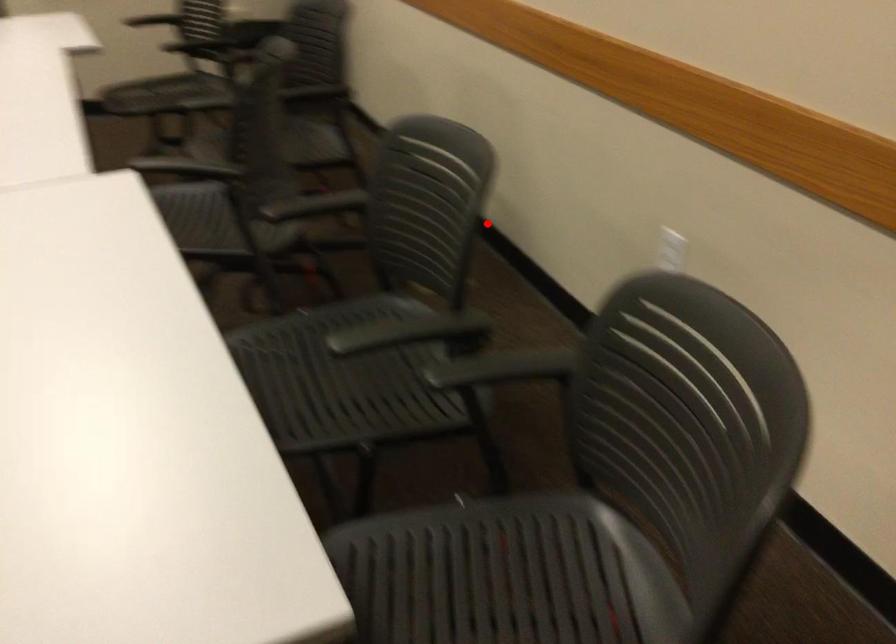
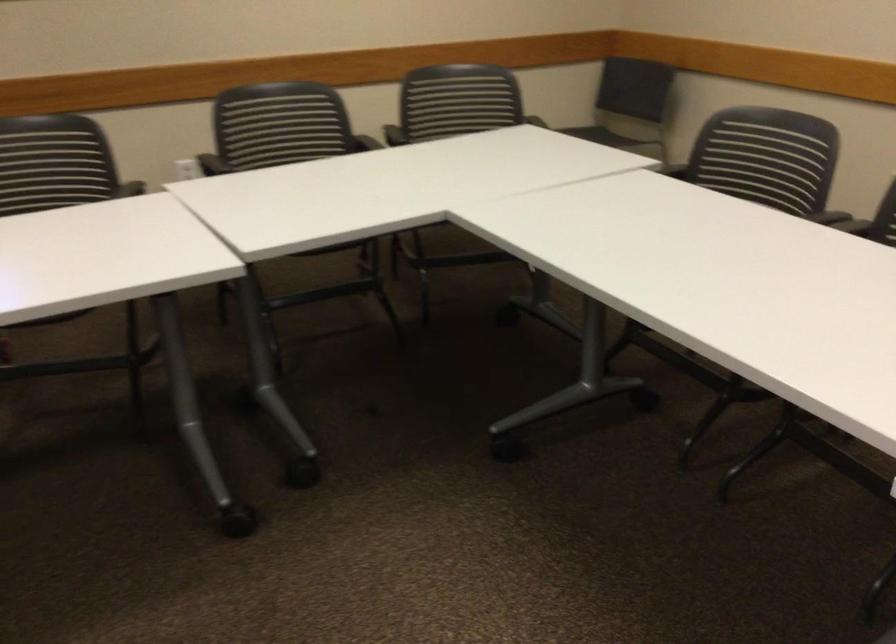
Locate, in the second image, the point that corresponds to the highlighted location in the first image.

(280, 124)